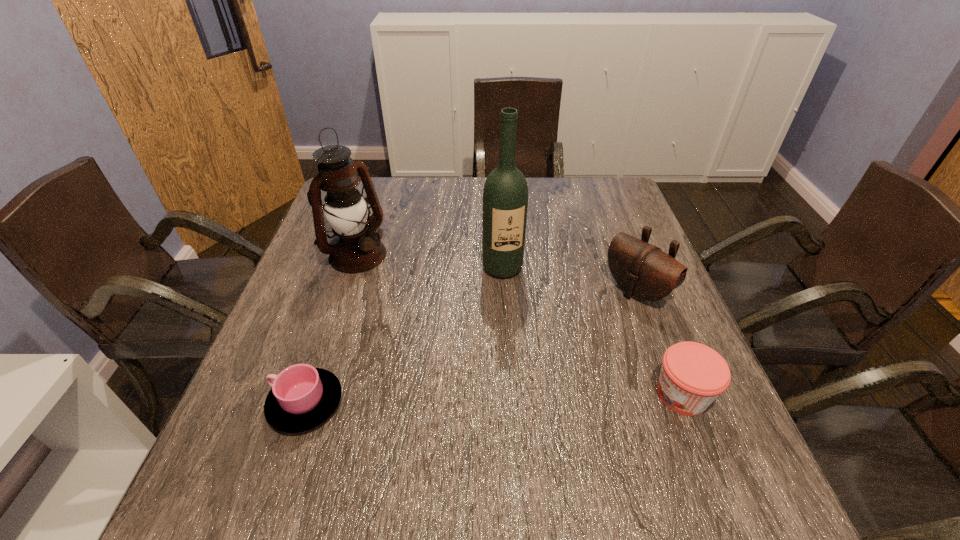
Where is `free space on the desktop that is between the shortest object and the jam and is positioned on the side of the lantern, there is a wick adjustment knob`? The height and width of the screenshot is (540, 960). free space on the desktop that is between the shortest object and the jam and is positioned on the side of the lantern, there is a wick adjustment knob is located at coordinates (547, 397).

This screenshot has height=540, width=960. Find the location of `free spot on the desktop that is between the cup and the second shortest object and is positioned on the labeled side of the wine bottle`. free spot on the desktop that is between the cup and the second shortest object and is positioned on the labeled side of the wine bottle is located at coordinates (544, 398).

Locate an element on the screen. vacant space on the desktop that is between the cup and the jam and is positioned with the flap open on the third tallest object is located at coordinates (492, 399).